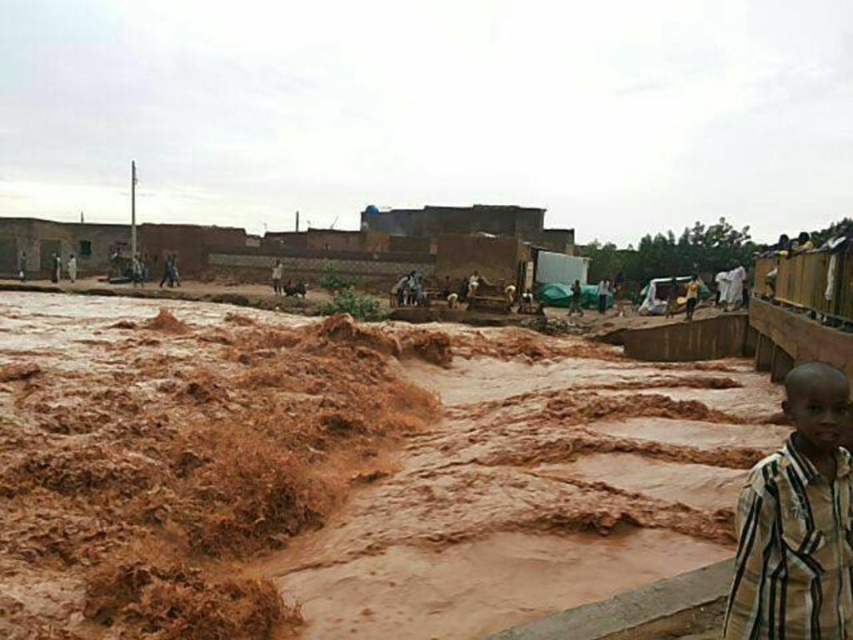
Which of these two, brown muddy water at lower left or striped fabric boy at lower right, stands taller?

With more height is brown muddy water at lower left.

What are the coordinates of `brown muddy water at lower left` in the screenshot? It's located at (344, 472).